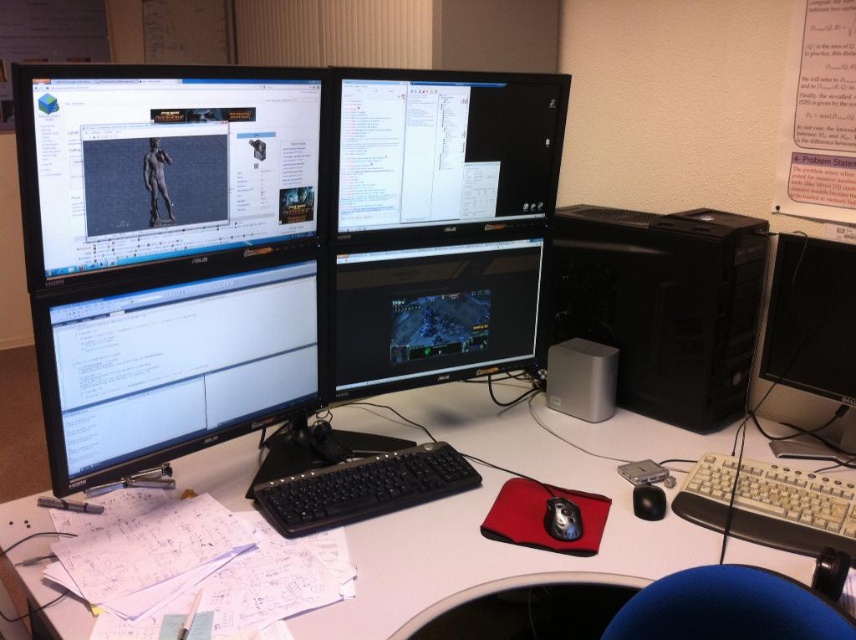
Is black glossy monitor at center to the right of black plastic keyboard at center from the viewer's perspective?

Correct, you'll find black glossy monitor at center to the right of black plastic keyboard at center.

Between black glossy monitor at center and black plastic keyboard at center, which one has more height?

black glossy monitor at center

Locate an element on the screen. The width and height of the screenshot is (856, 640). black glossy monitor at center is located at coordinates (432, 314).

In the scene shown: Which of these two, matte black monitor at upper left or black glossy monitor at lower left, stands taller?

matte black monitor at upper left

Is matte black monitor at upper left smaller than black glossy monitor at lower left?

Actually, matte black monitor at upper left might be larger than black glossy monitor at lower left.

Where is `matte black monitor at upper left`? Image resolution: width=856 pixels, height=640 pixels. matte black monitor at upper left is located at coordinates (162, 163).

Does matte black monitor at center come behind white plastic keyboard at lower right?

Yes, it is.

Between matte black monitor at center and white plastic keyboard at lower right, which one is positioned higher?

matte black monitor at center is higher up.

Is point (384, 141) more distant than point (795, 522)?

Yes.

Find the location of a particular element. The height and width of the screenshot is (640, 856). matte black monitor at center is located at coordinates (444, 150).